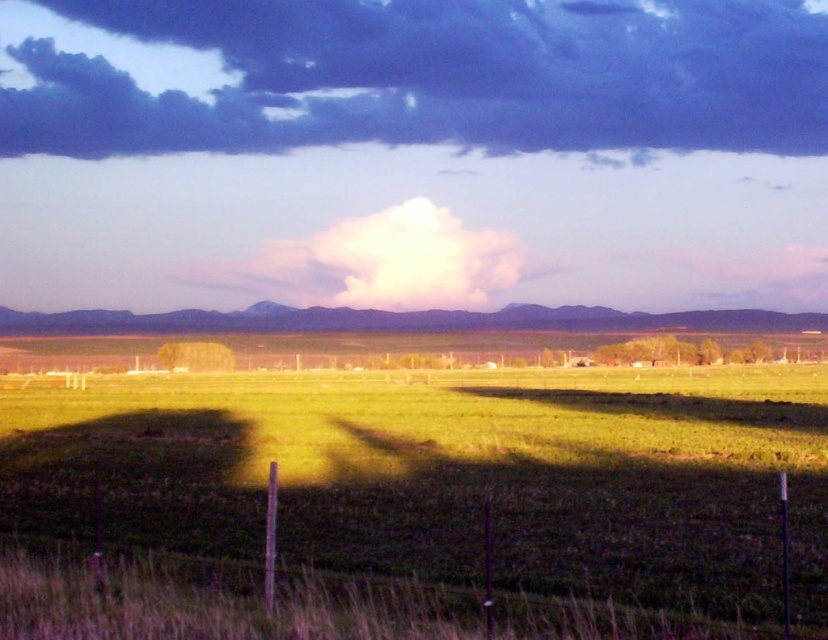
Is point (89, 451) positioned after point (35, 144)?

That is False.

Can you confirm if green grassy field at center is bigger than dark blue cloud at upper center?

No.

Identify the location of green grassy field at center. This screenshot has height=640, width=828. (451, 476).